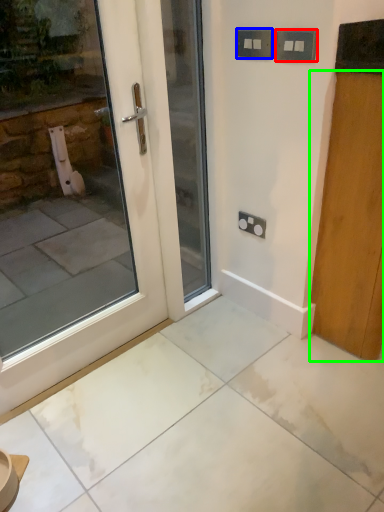
Question: Which is nearer to the electric outlet (highlighted by a red box)? electric outlet (highlighted by a blue box) or door (highlighted by a green box).

Choices:
 (A) electric outlet
 (B) door

Answer: (A)